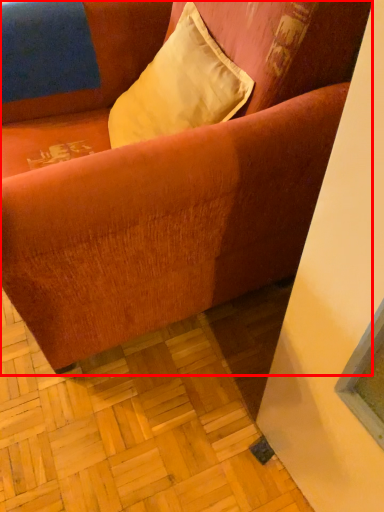
Question: Observing the image, what is the correct spatial positioning of studio couch (annotated by the red box) in reference to pillow?

Choices:
 (A) right
 (B) left

Answer: (B)